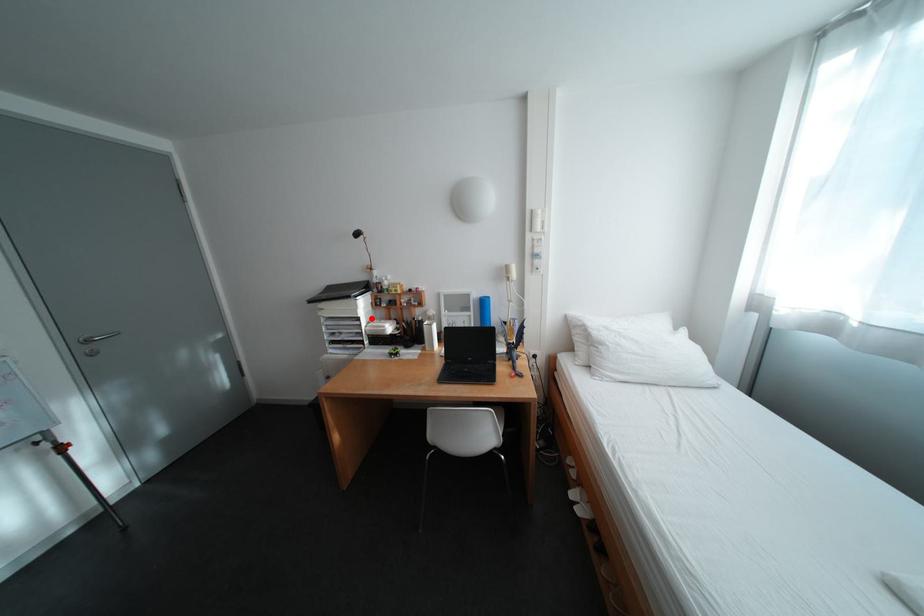
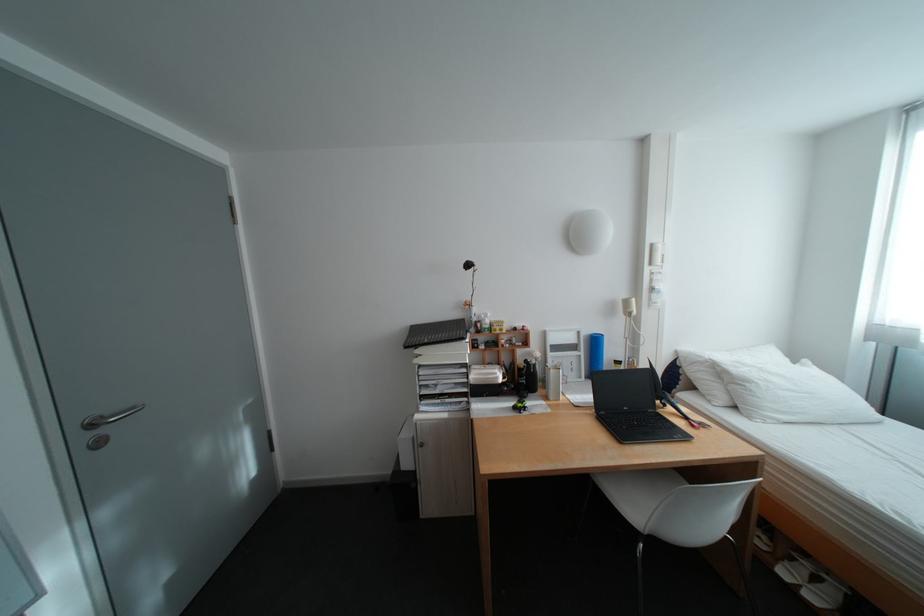
Locate, in the second image, the point that corresponds to the highlighted location in the first image.

(480, 363)